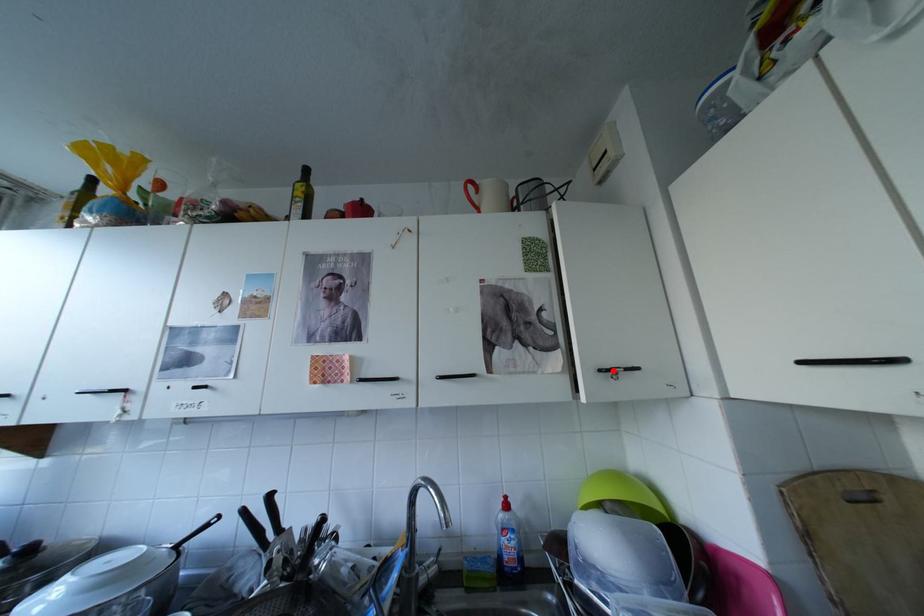
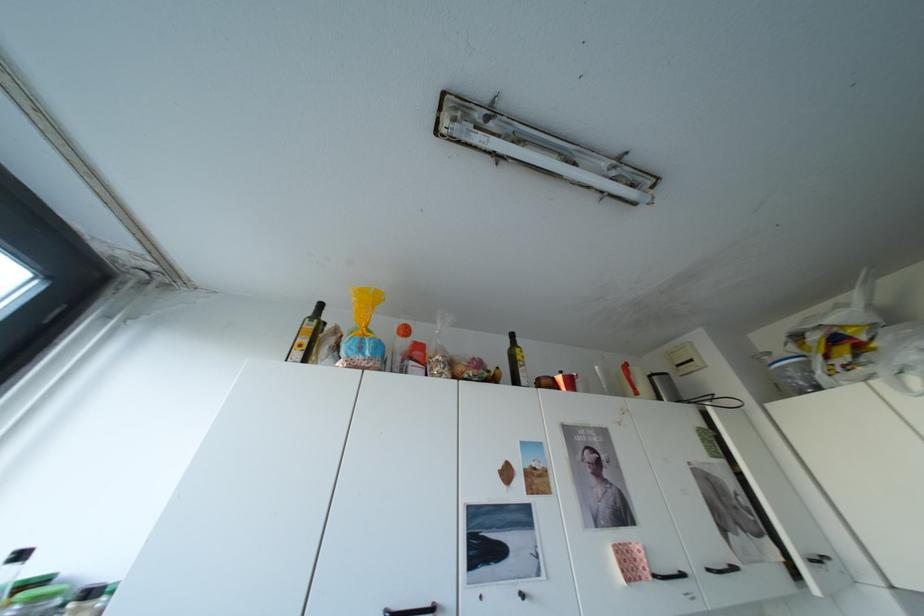
Where in the second image is the point corresponding to the highlighted location from the first image?

(824, 561)